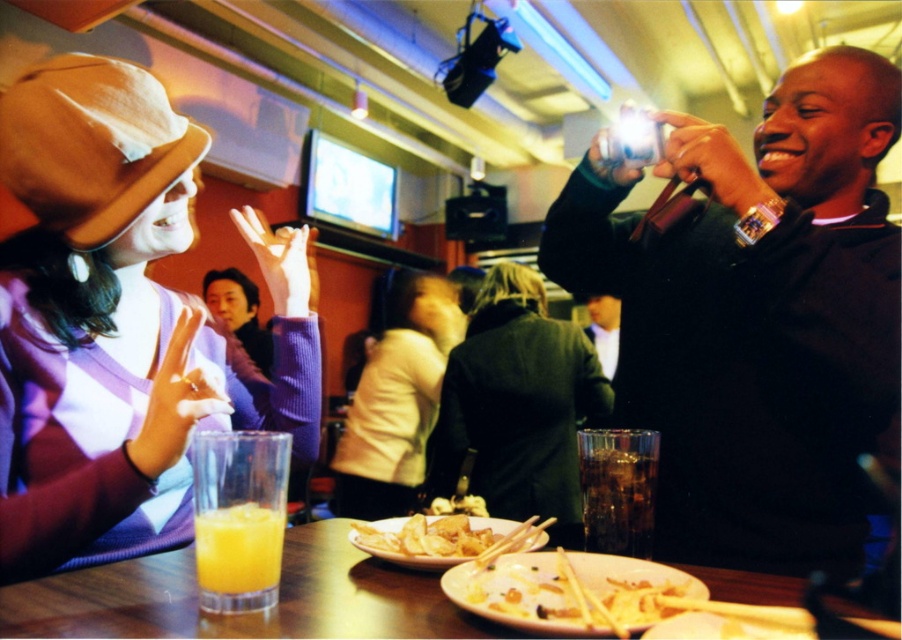
Question: Which object appears closest to the camera in this image?

Choices:
 (A) translucent glass orange juice at lower left
 (B) light beige sweater at center

Answer: (A)

Question: Can you confirm if dark brown leather jacket at center is positioned above light beige sweater at center?

Choices:
 (A) no
 (B) yes

Answer: (A)

Question: Does matte purple sweater at center have a greater width compared to light beige sweater at center?

Choices:
 (A) no
 (B) yes

Answer: (A)

Question: Based on their relative distances, which object is nearer to the translucent glass orange juice at lower left?

Choices:
 (A) golden crispy fries at center
 (B) dark blue shirt at center
 (C) translucent glass table at center

Answer: (C)

Question: Which of the following is the farthest from the observer?

Choices:
 (A) matte purple sweater at center
 (B) golden crispy fries at center
 (C) light beige sweater at center

Answer: (C)

Question: Does dark brown leather jacket at center appear on the left side of dark blue shirt at center?

Choices:
 (A) yes
 (B) no

Answer: (A)